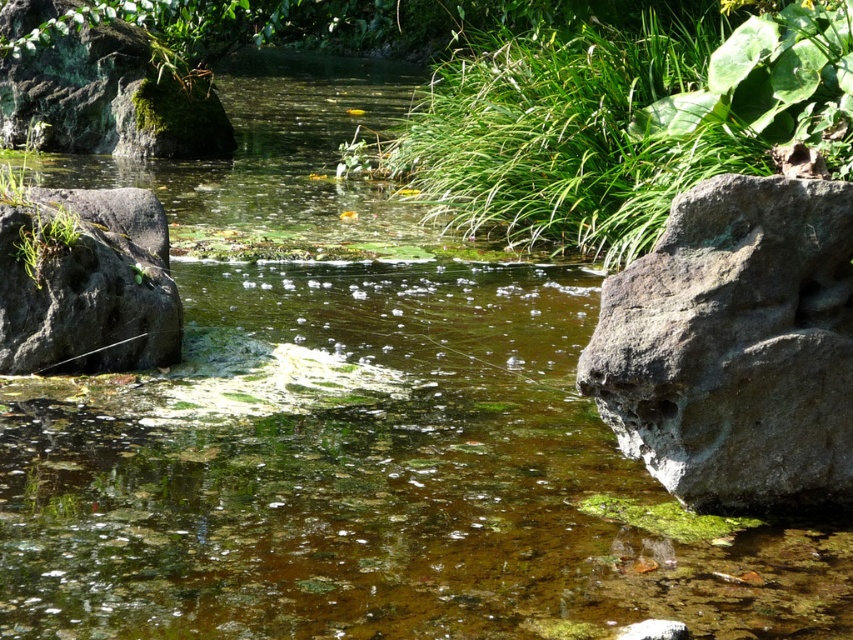
Does green leafy plant at center appear on the left side of gray rough rock at right?

Correct, you'll find green leafy plant at center to the left of gray rough rock at right.

Is point (540, 84) less distant than point (775, 176)?

No, it is behind (775, 176).

Image resolution: width=853 pixels, height=640 pixels. In order to click on green leafy plant at center in this screenshot , I will do `click(619, 125)`.

Measure the distance between green leafy plant at center and camera.

green leafy plant at center is 7.83 meters away from camera.

Between green leafy plant at center and green mossy rock at upper left, which one is positioned lower?

green leafy plant at center is below.

Find the location of a particular element. green leafy plant at center is located at coordinates (619, 125).

You are a GUI agent. You are given a task and a screenshot of the screen. Output one action in this format:
    pyautogui.click(x=<x>, y=<y>)
    Task: Click on the green leafy plant at center
    This screenshot has width=853, height=640.
    Given the screenshot: What is the action you would take?
    pyautogui.click(x=619, y=125)

Does gray rough rock at left have a lesser width compared to green mossy rock at upper left?

Yes, gray rough rock at left is thinner than green mossy rock at upper left.

Is point (167, 292) behind point (119, 76)?

No, (167, 292) is in front of (119, 76).

At what (x,y) coordinates should I click in order to perform the action: click on gray rough rock at left. Please return your answer as a coordinate pair (x, y). Image resolution: width=853 pixels, height=640 pixels. Looking at the image, I should click on (90, 285).